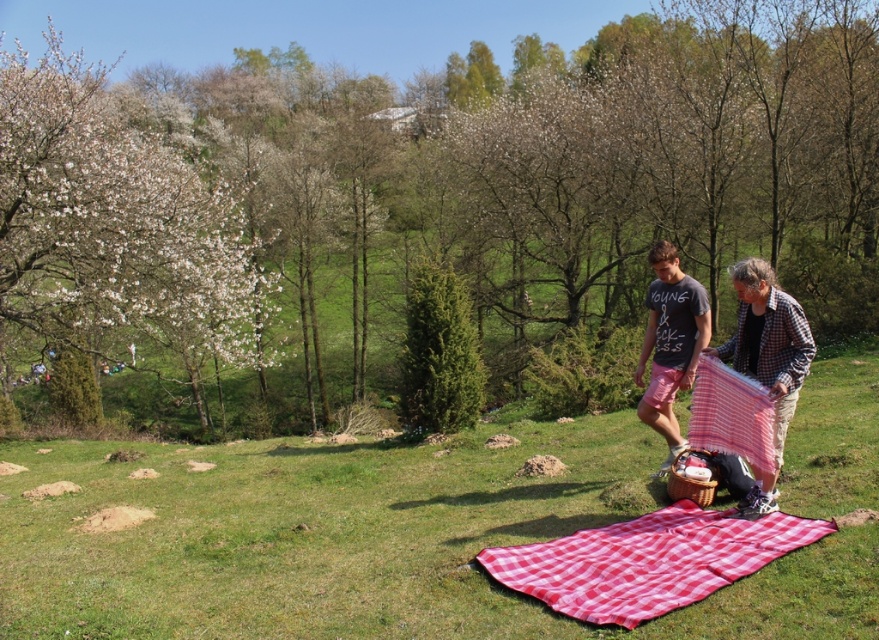
Who is positioned more to the right, green grass at center or white blossoming tree at left?

green grass at center

Can you confirm if green grass at center is shorter than white blossoming tree at left?

Correct, green grass at center is not as tall as white blossoming tree at left.

Locate an element on the screen. This screenshot has height=640, width=879. green grass at center is located at coordinates (369, 540).

Between green leafy tree at center and white blossoming tree at left, which one has less height?

white blossoming tree at left is shorter.

Is green leafy tree at center above white blossoming tree at left?

Indeed, green leafy tree at center is positioned over white blossoming tree at left.

Identify the location of green leafy tree at center. (427, 208).

Who is taller, green leafy tree at center or red checkered cloth at lower right?

With more height is green leafy tree at center.

Locate an element on the screen. The width and height of the screenshot is (879, 640). green leafy tree at center is located at coordinates (427, 208).

Is point (481, 90) positioned in front of point (706, 362)?

No, (481, 90) is further to viewer.

Find the location of `green leafy tree at center`. green leafy tree at center is located at coordinates point(427,208).